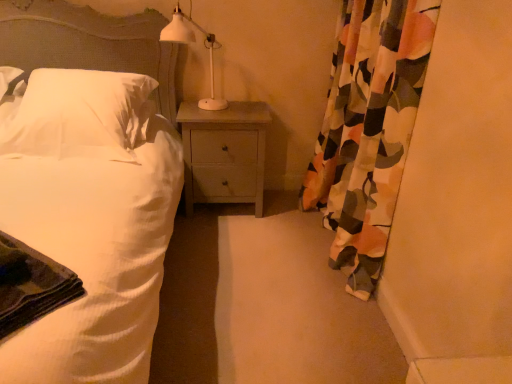
What do you see at coordinates (194, 42) in the screenshot? This screenshot has width=512, height=384. I see `white matte table lamp at upper center` at bounding box center [194, 42].

Measure the distance between white soft pillow at left and camera.

They are 6.31 feet apart.

What do you see at coordinates (90, 223) in the screenshot? The width and height of the screenshot is (512, 384). I see `white textured bed at left` at bounding box center [90, 223].

Locate an element on the screen. The image size is (512, 384). light wood nightstand at center is located at coordinates (224, 153).

Where is `white matte table lamp at upper center`? Image resolution: width=512 pixels, height=384 pixels. white matte table lamp at upper center is located at coordinates (194, 42).

Find the location of a particular element. The height and width of the screenshot is (384, 512). nightstand lying below the white matte table lamp at upper center (from the image's perspective) is located at coordinates (224, 153).

Is light wood nightstand at center with white matte table lamp at upper center?

No, light wood nightstand at center is not next to white matte table lamp at upper center.

Which object is closer to the camera taking this photo, light wood nightstand at center or white matte table lamp at upper center?

white matte table lamp at upper center is closer to the camera.

Between light wood nightstand at center and white matte table lamp at upper center, which one has less height?

white matte table lamp at upper center is shorter.

From the image's perspective, is dark green fabric at lower left under floral fabric curtain at right?

Yes, from the image's perspective, dark green fabric at lower left is below floral fabric curtain at right.

Is floral fabric curtain at right surrounded by dark green fabric at lower left?

That's incorrect, floral fabric curtain at right is not inside dark green fabric at lower left.

Is dark green fabric at lower left directly adjacent to floral fabric curtain at right?

They are not placed beside each other.

Is dark green fabric at lower left facing away from white matte table lamp at upper center?

No, dark green fabric at lower left's orientation is not away from white matte table lamp at upper center.

Can you confirm if dark green fabric at lower left is bigger than white matte table lamp at upper center?

Incorrect, dark green fabric at lower left is not larger than white matte table lamp at upper center.

Can you confirm if dark green fabric at lower left is shorter than white matte table lamp at upper center?

Indeed, dark green fabric at lower left has a lesser height compared to white matte table lamp at upper center.

Can you tell me how much white soft pillow at left and floral fabric curtain at right differ in facing direction?

87.3 degrees.

In the scene shown: Which object is further away from the camera, white soft pillow at left or floral fabric curtain at right?

white soft pillow at left is behind.

Locate an element on the screen. curtain in front of the white soft pillow at left is located at coordinates (369, 129).

Is white soft pillow at left positioned beyond the bounds of floral fabric curtain at right?

Indeed, white soft pillow at left is completely outside floral fabric curtain at right.

Is floral fabric curtain at right taller than dark green fabric at lower left?

Yes, floral fabric curtain at right is taller than dark green fabric at lower left.

Does floral fabric curtain at right have a larger size compared to dark green fabric at lower left?

Yes.

Is floral fabric curtain at right facing away from dark green fabric at lower left?

floral fabric curtain at right does not have its back to dark green fabric at lower left.

Between white textured bed at left and white matte table lamp at upper center, which one has smaller size?

white matte table lamp at upper center.

From the image's perspective, does white textured bed at left appear lower than white matte table lamp at upper center?

Yes, from the image's perspective, white textured bed at left is beneath white matte table lamp at upper center.

Is white textured bed at left looking in the opposite direction of white matte table lamp at upper center?

No, white matte table lamp at upper center is not at the back of white textured bed at left.

From a real-world perspective, is white textured bed at left on top of white matte table lamp at upper center?

No, from a real-world perspective, white textured bed at left is not on top of white matte table lamp at upper center.

Considering the sizes of objects light wood nightstand at center and floral fabric curtain at right in the image provided, who is taller, light wood nightstand at center or floral fabric curtain at right?

floral fabric curtain at right.

There is a light wood nightstand at center. At what (x,y) coordinates should I click in order to perform the action: click on curtain above it (from a real-world perspective). Please return your answer as a coordinate pair (x, y). Looking at the image, I should click on (369, 129).

Measure the distance from light wood nightstand at center to floral fabric curtain at right.

A distance of 25.00 inches exists between light wood nightstand at center and floral fabric curtain at right.

In the image, there is a white matte table lamp at upper center. At what (x,y) coordinates should I click in order to perform the action: click on nightstand below it (from a real-world perspective). Please return your answer as a coordinate pair (x, y). This screenshot has height=384, width=512. Looking at the image, I should click on (224, 153).

The image size is (512, 384). I want to click on curtain behind the dark green fabric at lower left, so click(369, 129).

Considering their positions, is dark green fabric at lower left positioned further to white matte table lamp at upper center than white soft pillow at left?

dark green fabric at lower left lies further to white matte table lamp at upper center than the other object.

From the image, which object appears to be nearer to light wood nightstand at center, white soft pillow at left or dark green fabric at lower left?

white soft pillow at left lies closer to light wood nightstand at center than the other object.

Which object lies nearer to the anchor point white soft pillow at left, light wood nightstand at center or dark green fabric at lower left?

light wood nightstand at center is closer to white soft pillow at left.

Estimate the real-world distances between objects in this image. Which object is closer to floral fabric curtain at right, dark green fabric at lower left or white soft pillow at left?

white soft pillow at left.

Considering their positions, is dark green fabric at lower left positioned closer to white soft pillow at left than floral fabric curtain at right?

The object closer to white soft pillow at left is dark green fabric at lower left.

In the scene shown: Looking at the image, which one is located further to floral fabric curtain at right, white matte table lamp at upper center or dark green fabric at lower left?

dark green fabric at lower left.

Which object lies further to the anchor point white textured bed at left, dark green fabric at lower left or white soft pillow at left?

The object further to white textured bed at left is dark green fabric at lower left.

Estimate the real-world distances between objects in this image. Which object is further from dark green fabric at lower left, light wood nightstand at center or white textured bed at left?

light wood nightstand at center.

At what (x,y) coordinates should I click in order to perform the action: click on nightstand between white soft pillow at left and floral fabric curtain at right in the horizontal direction. Please return your answer as a coordinate pair (x, y). Looking at the image, I should click on (224, 153).

This screenshot has width=512, height=384. I want to click on pillow between dark green fabric at lower left and light wood nightstand at center from front to back, so click(79, 115).

This screenshot has height=384, width=512. In order to click on pillow between white textured bed at left and floral fabric curtain at right in this screenshot , I will do `click(79, 115)`.

Locate an element on the screen. The width and height of the screenshot is (512, 384). table lamp between dark green fabric at lower left and light wood nightstand at center from front to back is located at coordinates (194, 42).